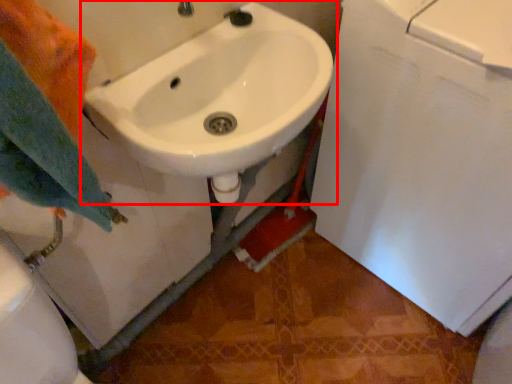
Question: From the image's perspective, what is the correct spatial positioning of sink (annotated by the red box) in reference to bath towel?

Choices:
 (A) below
 (B) above

Answer: (B)